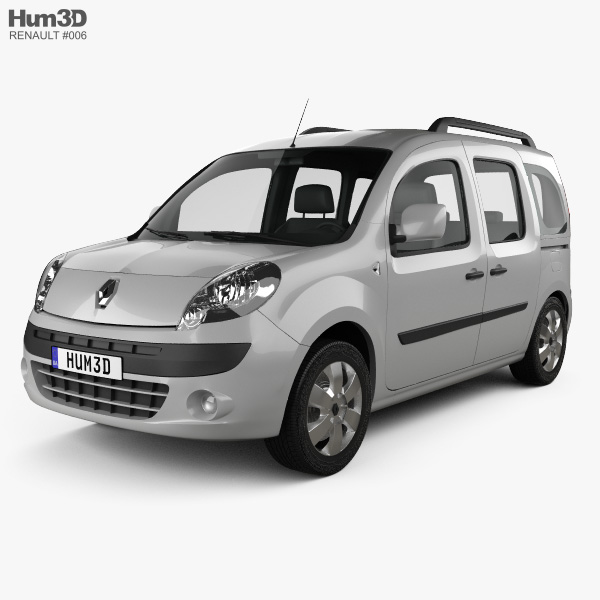
At what (x,y) coordinates should I click in order to perform the action: click on left doors. Please return your answer as a coordinate pair (x, y). The height and width of the screenshot is (600, 600). Looking at the image, I should click on (450, 299), (514, 300).